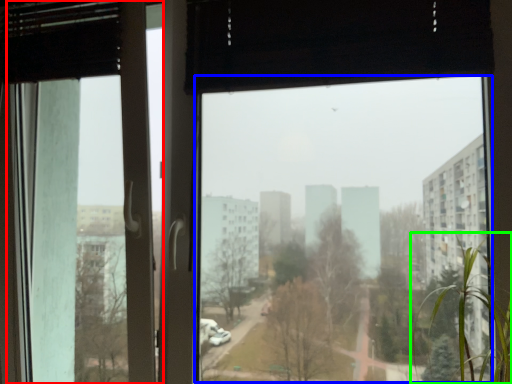
Question: Which object is the farthest from screen door (highlighted by a red box)? Choose among these: window screen (highlighted by a blue box) or tree (highlighted by a green box).

Choices:
 (A) window screen
 (B) tree

Answer: (A)